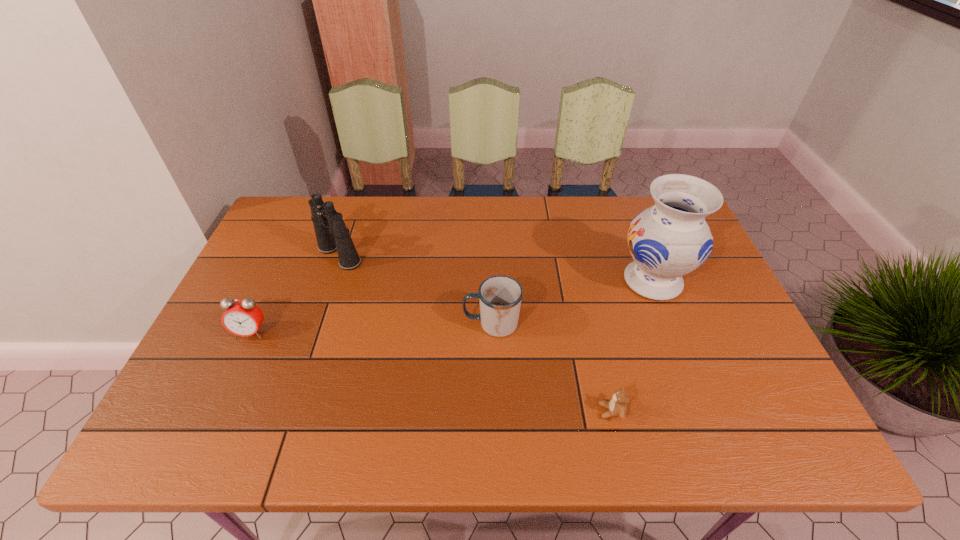
The image size is (960, 540). I want to click on vase, so click(670, 239).

Where is `the tallest object`? The image size is (960, 540). the tallest object is located at coordinates (670, 239).

I want to click on the second object from left to right, so click(x=332, y=235).

The width and height of the screenshot is (960, 540). In order to click on the fourth shortest object in this screenshot , I will do `click(332, 235)`.

The width and height of the screenshot is (960, 540). Find the location of `the third object from left to right`. the third object from left to right is located at coordinates (500, 297).

Find the location of a particular element. alarm clock is located at coordinates (243, 318).

What are the coordinates of `the nearest object` in the screenshot? It's located at (617, 405).

Identify the location of the shortest object. The image size is (960, 540). (617, 405).

The width and height of the screenshot is (960, 540). Identify the location of vacant region located on the front of the rightmost object. (687, 369).

Locate an element on the screen. The image size is (960, 540). vacant position located 0.150m on the back of the fourth object from right to left is located at coordinates (354, 212).